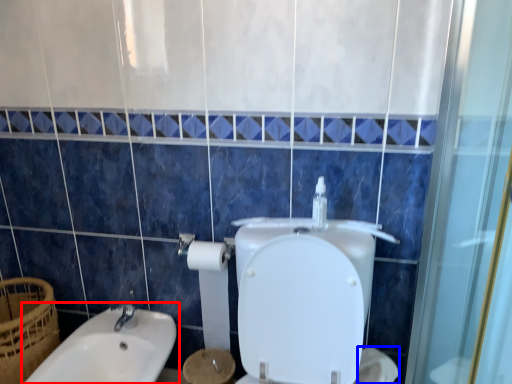
Question: Which of the following is the farthest to the observer, sink (highlighted by a red box) or toilet paper (highlighted by a blue box)?

Choices:
 (A) sink
 (B) toilet paper

Answer: (B)